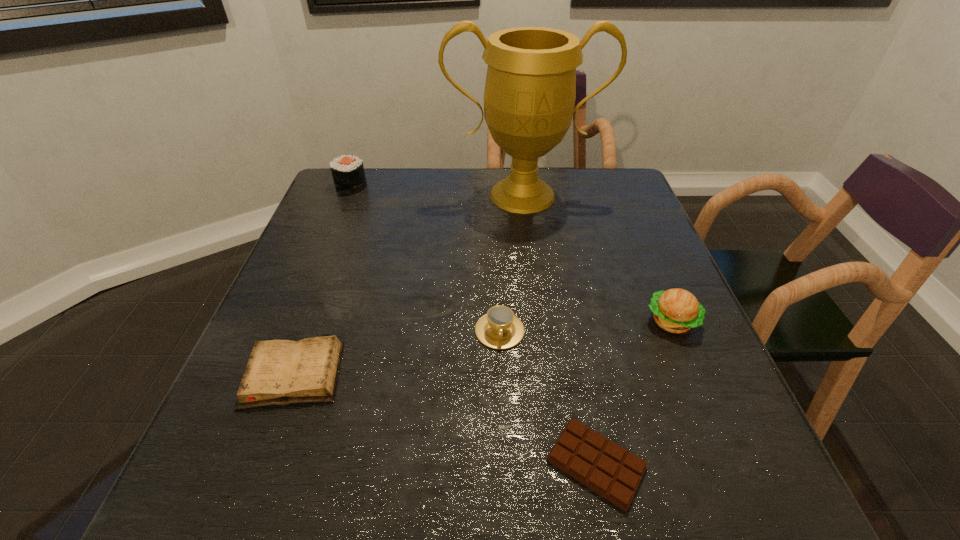
Where is `object present at the far left corner`? object present at the far left corner is located at coordinates (348, 173).

You are a GUI agent. You are given a task and a screenshot of the screen. Output one action in this format:
    pyautogui.click(x=<x>, y=<y>)
    Task: Click on the object that is at the far right corner
    
    Given the screenshot: What is the action you would take?
    pyautogui.click(x=529, y=97)

Locate an element on the screen. free region at the far edge of the desktop is located at coordinates (431, 201).

You are a GUI agent. You are given a task and a screenshot of the screen. Output one action in this format:
    pyautogui.click(x=<x>, y=<y>)
    Task: Click on the blank space at the left edge of the desktop
    This screenshot has height=540, width=960.
    Given the screenshot: What is the action you would take?
    pyautogui.click(x=357, y=230)

The height and width of the screenshot is (540, 960). I want to click on free space at the right edge of the desktop, so click(x=683, y=449).

Locate an element on the screen. The width and height of the screenshot is (960, 540). vacant space at the far left corner of the desktop is located at coordinates (369, 211).

Locate an element on the screen. vacant space at the far right corner of the desktop is located at coordinates (636, 197).

At what (x,y) coordinates should I click in order to perform the action: click on vacant area that lies between the fifth tallest object and the candy bar. Please return your answer as a coordinate pair (x, y). The image size is (960, 540). Looking at the image, I should click on click(444, 418).

The height and width of the screenshot is (540, 960). In order to click on free space that is in between the diary and the cup in this screenshot , I will do `click(396, 352)`.

At what (x,y) coordinates should I click in order to perform the action: click on blank region between the diary and the cup. Please return your answer as a coordinate pair (x, y). The image size is (960, 540). Looking at the image, I should click on (396, 352).